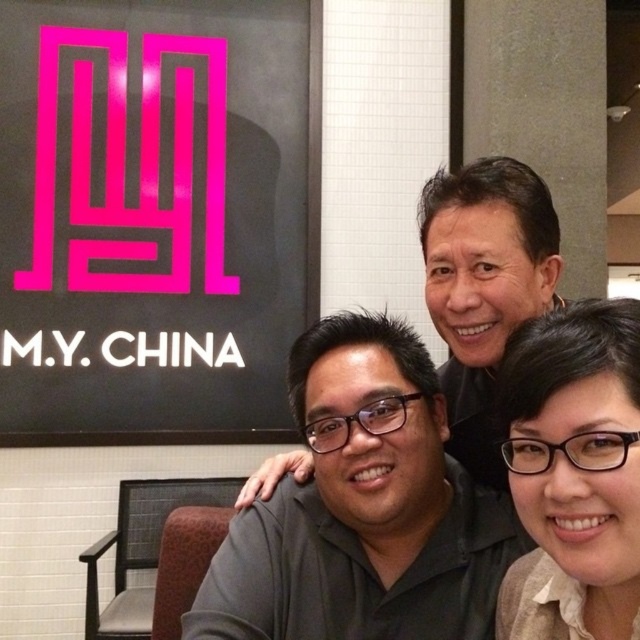
Question: From the image, what is the correct spatial relationship of matte black shirt at center in relation to matte black glasses at lower right?

Choices:
 (A) right
 (B) left

Answer: (B)

Question: Which point is farther from the camera taking this photo?

Choices:
 (A) (410, 332)
 (B) (604, 468)

Answer: (A)

Question: Which point appears closest to the camera in this image?

Choices:
 (A) (468, 588)
 (B) (609, 417)

Answer: (B)

Question: Can you confirm if matte black shirt at center is positioned to the right of matte black glasses at lower right?

Choices:
 (A) yes
 (B) no

Answer: (B)

Question: Among these objects, which one is nearest to the camera?

Choices:
 (A) matte black shirt at center
 (B) matte black glasses at lower right

Answer: (B)

Question: Can you confirm if matte black shirt at center is positioned to the left of matte black glasses at lower right?

Choices:
 (A) no
 (B) yes

Answer: (B)